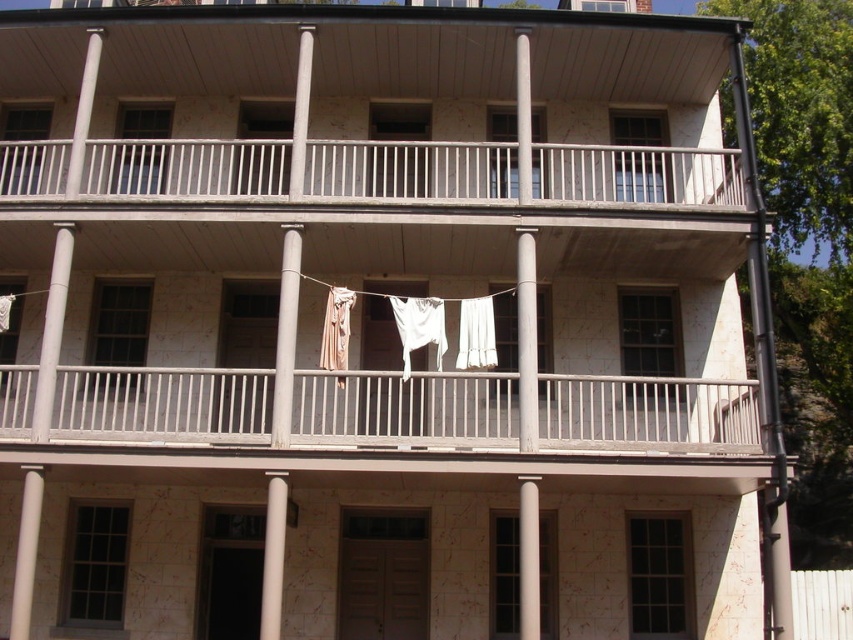
You are a painter who needs to hang a 1.2 meter wide canvas between the wooden railings at center and the white fabric at center. Can you fit it there?

The wooden railings at center might be wider than white fabric at center, so the space between them could be sufficient to fit the 1.2 meter wide canvas. However, since the exact width isn not specified, it is uncertain. You should measure the space first before deciding.

Consider the image. You are standing in front of the building and notice the wooden railings at center and the white fabric at center. Which object is located below the other?

The wooden railings at center is positioned under the white fabric at center, so the wooden railings at center is below the white fabric at center.

You are standing in front of the building and notice the wooden railings at center and the white fabric at center. Which object is positioned more to the left side from your viewpoint?

The wooden railings at center is positioned more to the left side from your viewpoint as it is to the left of the white fabric at center.